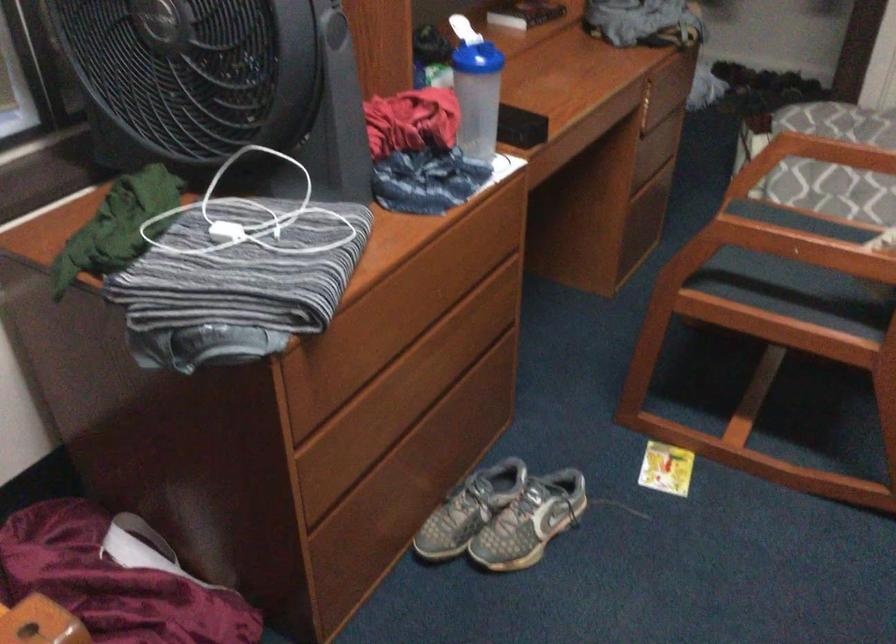
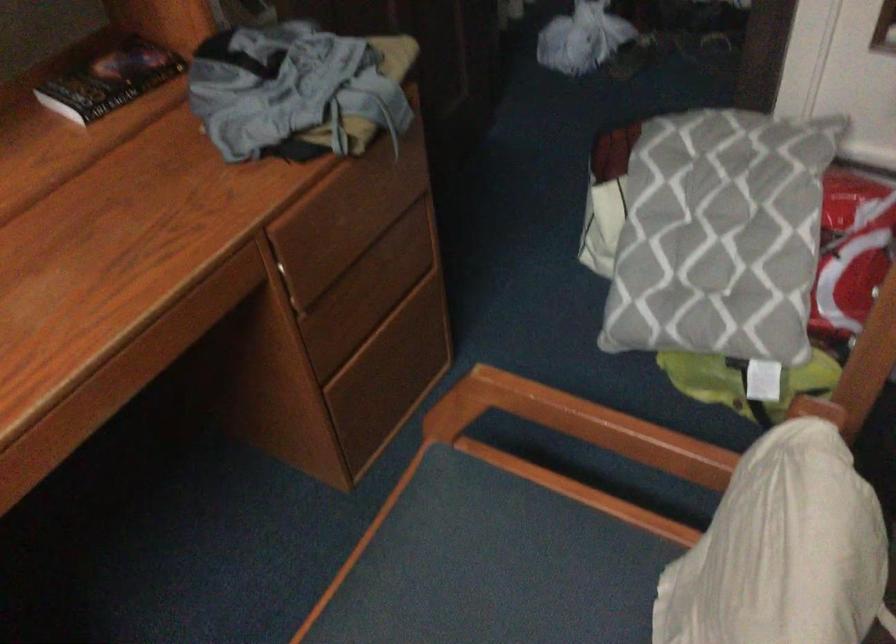
The point at (648, 102) is marked in the first image. Where is the corresponding point in the second image?

(299, 276)